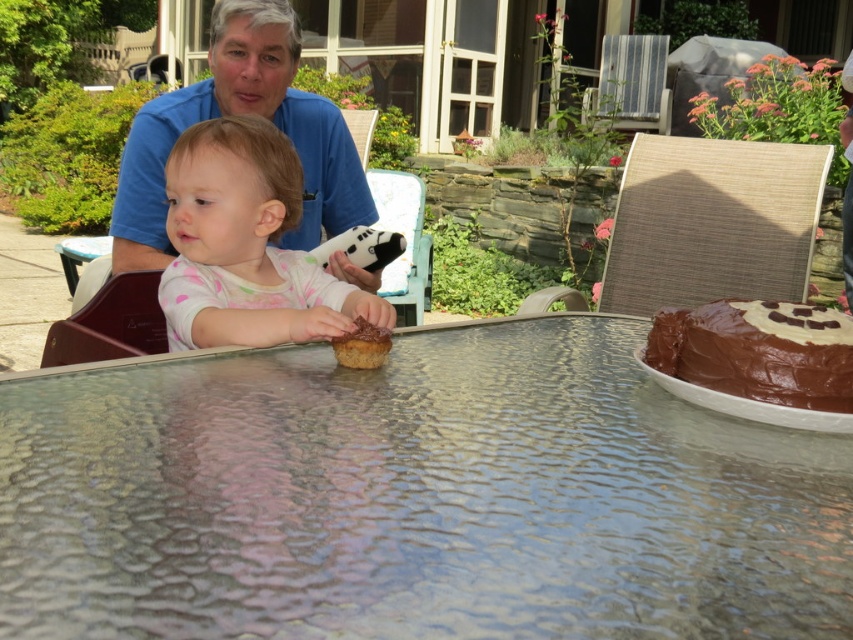
Does white dotted fabric at center appear over chocolate cake at center?

Yes.

Is white dotted fabric at center closer to the viewer compared to chocolate cake at center?

No, white dotted fabric at center is behind chocolate cake at center.

Does point (196, 259) come in front of point (331, 344)?

No, it is not.

You are a GUI agent. You are given a task and a screenshot of the screen. Output one action in this format:
    pyautogui.click(x=<x>, y=<y>)
    Task: Click on the white dotted fabric at center
    
    Given the screenshot: What is the action you would take?
    pyautogui.click(x=247, y=244)

Does transparent textured glass at center have a lesser height compared to white dotted fabric at center?

Correct, transparent textured glass at center is not as tall as white dotted fabric at center.

Is point (334, 536) less distant than point (285, 314)?

Yes, point (334, 536) is in front of point (285, 314).

Where is `transparent textured glass at center`? This screenshot has width=853, height=640. transparent textured glass at center is located at coordinates (412, 497).

Looking at this image, who is more distant from viewer, (241,83) or (747,328)?

The point (241,83) is more distant.

The image size is (853, 640). Describe the element at coordinates (241, 113) in the screenshot. I see `matte blue shirt at upper left` at that location.

This screenshot has height=640, width=853. Find the location of `matte blue shirt at upper left`. matte blue shirt at upper left is located at coordinates (241, 113).